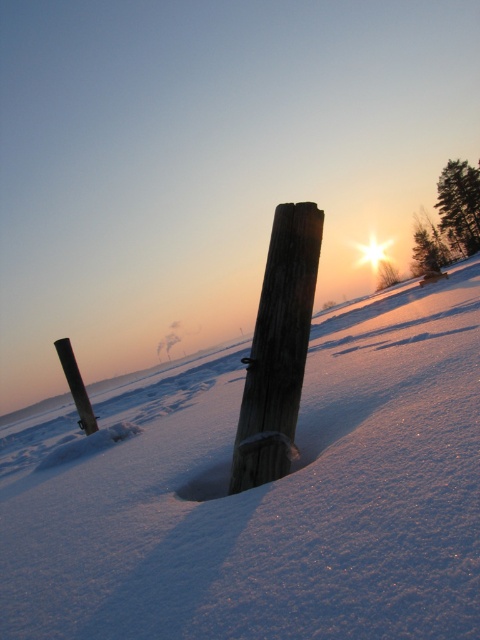
Which is more to the left, weathered wood post at center or black wood post at lower left?

black wood post at lower left is more to the left.

Which is behind, point (298, 252) or point (83, 406)?

Point (83, 406)

Where is `weathered wood post at center`? This screenshot has height=640, width=480. weathered wood post at center is located at coordinates (277, 348).

Which is below, white powdery snow at center or weathered wood post at center?

white powdery snow at center is below.

Find the location of a particular element. white powdery snow at center is located at coordinates (264, 493).

Can you confirm if white powdery snow at center is thinner than black wood post at lower left?

No.

Does point (336, 547) lie in front of point (78, 376)?

Yes.

Where is `white powdery snow at center`? This screenshot has width=480, height=640. white powdery snow at center is located at coordinates (x=264, y=493).

You are a GUI agent. You are given a task and a screenshot of the screen. Output one action in this format:
    pyautogui.click(x=<x>, y=<y>)
    Task: Click on the white powdery snow at center
    The height and width of the screenshot is (640, 480).
    Given the screenshot: What is the action you would take?
    pyautogui.click(x=264, y=493)